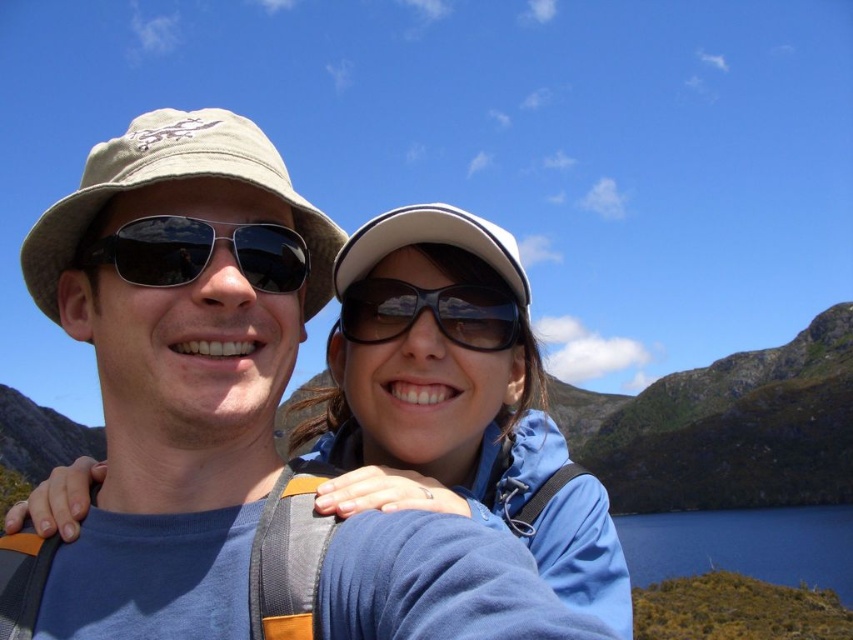
You are planning to take a photo of the matte blue jacket at center and the khaki fabric hat at left. Which object should you zoom in on to ensure both fit in the frame without cropping?

The khaki fabric hat at left should be zoomed in on because the matte blue jacket at center is wider, so focusing on it might require a wider angle to fit both.

You are a photographer positioned at the origin point of the image coordinate system. You want to capture a photo of the matte blue jacket at center. What are the coordinates where you should aim your camera?

The coordinates where you should aim your camera are at point (456, 397).

You are a photographer standing at the center of the scene. You want to take a photo that includes both the khaki fabric hat at left and the white fabric cap at upper center. Given that your camera has a maximum zoom range that can capture objects up to 10 meters apart, will you be able to include both in the same frame without moving?

The khaki fabric hat at left and white fabric cap at upper center are 9.58 meters apart from each other. Since the distance between them is less than the camera maximum zoom range of 10 meters, you can include both in the same frame without moving.